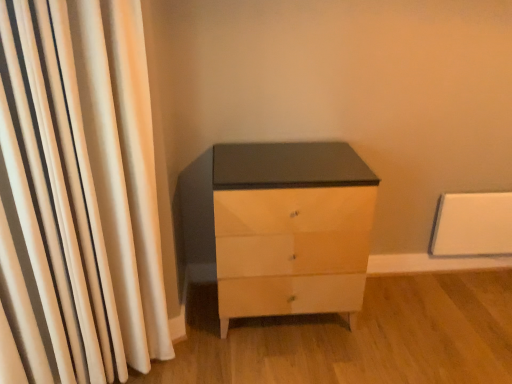
Question: In the image, is matte white chest of drawers at center positioned in front of or behind white fabric curtain at left?

Choices:
 (A) behind
 (B) front

Answer: (A)

Question: Is matte white chest of drawers at center wider or thinner than white fabric curtain at left?

Choices:
 (A) thin
 (B) wide

Answer: (B)

Question: Is matte white chest of drawers at center spatially inside white fabric curtain at left, or outside of it?

Choices:
 (A) inside
 (B) outside

Answer: (B)

Question: From the image's perspective, relative to matte white chest of drawers at center, is white fabric curtain at left above or below?

Choices:
 (A) below
 (B) above

Answer: (B)

Question: In the image, is white fabric curtain at left positioned in front of or behind matte white chest of drawers at center?

Choices:
 (A) front
 (B) behind

Answer: (A)

Question: Does point (84, 64) appear closer or farther from the camera than point (295, 201)?

Choices:
 (A) farther
 (B) closer

Answer: (B)

Question: Is white fabric curtain at left wider or thinner than matte white chest of drawers at center?

Choices:
 (A) thin
 (B) wide

Answer: (A)